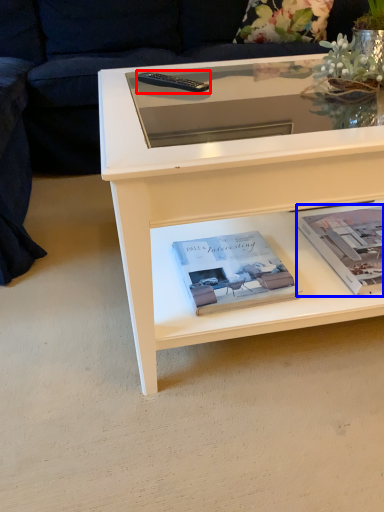
Question: Which point is further to the camera, remote (highlighted by a red box) or paperback book (highlighted by a blue box)?

Choices:
 (A) remote
 (B) paperback book

Answer: (A)